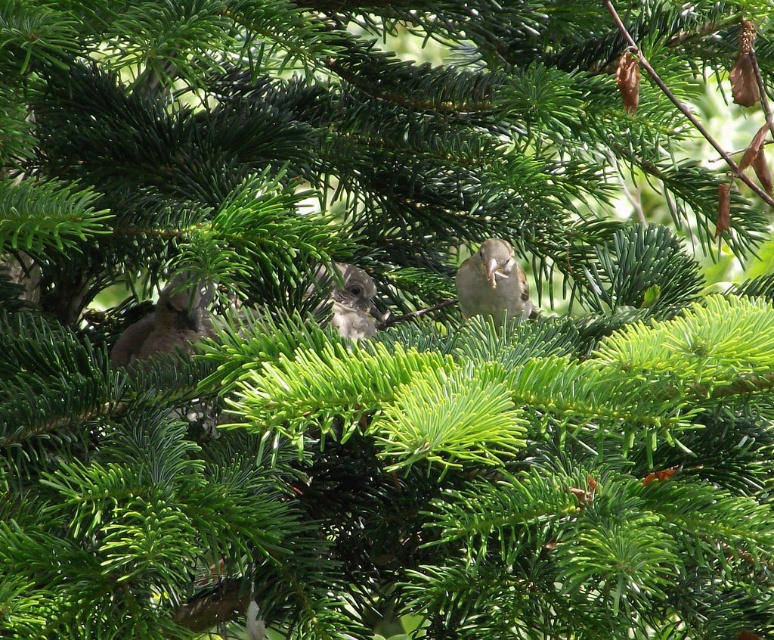
You are an ornithologist observing the birds in the tree. You notice two points of interest marked in the image. One is at point (118, 364) and the other at point (492, 250). Which point is closer to you?

Point (118, 364) is closer to the viewer than point (492, 250).

You are a birdwatcher trying to locate a specific bird in the image. The bird you are looking for is at point coordinates of (165, 323). Based on the scene description, can you identify which bird this point corresponds to?

The point at coordinates (165, 323) is on the brown feathered bird at left.

You are observing the birds in the tree. Which of the two birds, the brown feathered bird at left or the brown feathered bird at center, is bigger?

The brown feathered bird at left is larger than the brown feathered bird at center.